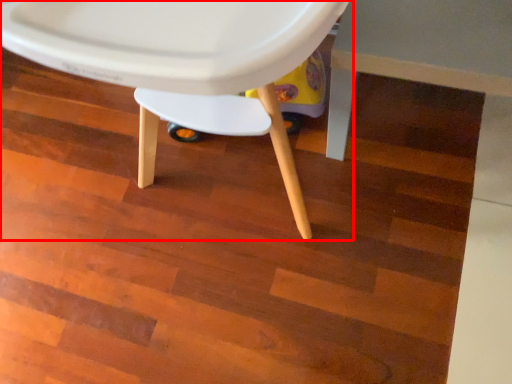
Question: From the image, what is the correct spatial relationship of chair (annotated by the red box) in relation to table?

Choices:
 (A) left
 (B) right

Answer: (A)